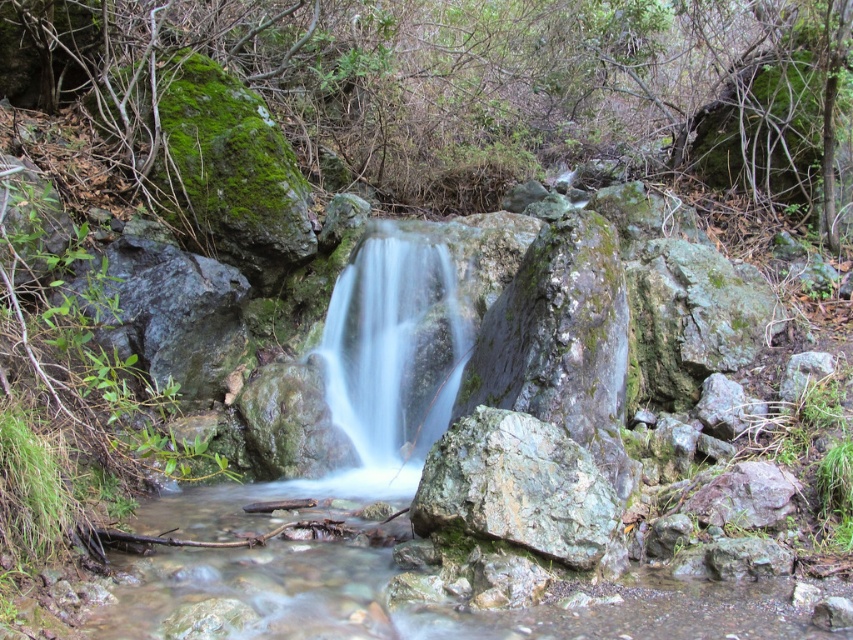
Question: Can you confirm if clear water at center is positioned to the right of gray rough rock at center?

Choices:
 (A) no
 (B) yes

Answer: (A)

Question: Among these points, which one is nearest to the camera?

Choices:
 (A) (463, 484)
 (B) (370, 348)

Answer: (A)

Question: Is clear water at center in front of gray rough rock at center?

Choices:
 (A) yes
 (B) no

Answer: (B)

Question: Does clear water at center appear on the left side of gray rough rock at center?

Choices:
 (A) yes
 (B) no

Answer: (A)

Question: Which point is closer to the camera taking this photo?

Choices:
 (A) click(537, 433)
 (B) click(376, 374)

Answer: (A)